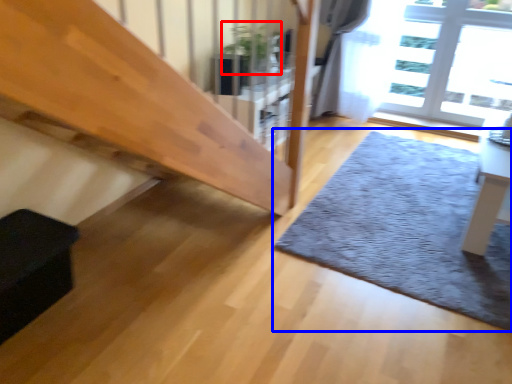
Question: Which of the following is the farthest to the observer, plant (highlighted by a red box) or mat (highlighted by a blue box)?

Choices:
 (A) plant
 (B) mat

Answer: (A)